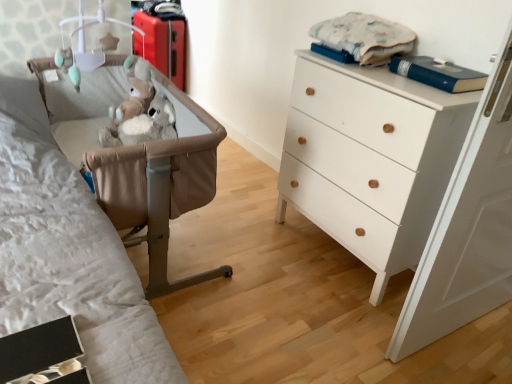
Describe the element at coordinates (160, 189) in the screenshot. I see `tan leather crib at left` at that location.

The width and height of the screenshot is (512, 384). Find the location of `tan leather crib at left`. tan leather crib at left is located at coordinates (160, 189).

The width and height of the screenshot is (512, 384). What do you see at coordinates (85, 44) in the screenshot?
I see `white plastic mobile at upper left` at bounding box center [85, 44].

Find the location of a particular element. This screenshot has width=512, height=384. matte red suitcase at upper left is located at coordinates pos(162,38).

In order to face matte red suitcase at upper left, should I rotate leftwards or rightwards?

Turn left by 12.718 degrees to look at matte red suitcase at upper left.

Find the location of a particular element. This screenshot has height=384, width=512. white wood chest of drawers at right is located at coordinates pos(370,159).

Is white wood chest of drawers at right completely or partially inside white plastic mobile at upper left?

No, white wood chest of drawers at right is not a part of white plastic mobile at upper left.

Is white plastic mobile at upper left touching white wood chest of drawers at right?

No.

In the scene shown: How different are the orientations of white plastic mobile at upper left and white wood chest of drawers at right in degrees?

The angular difference between white plastic mobile at upper left and white wood chest of drawers at right is 91.2 degrees.

Which is more to the right, white plastic mobile at upper left or white wood chest of drawers at right?

Positioned to the right is white wood chest of drawers at right.

Measure the distance between matte red suitcase at upper left and white wood chest of drawers at right.

matte red suitcase at upper left and white wood chest of drawers at right are 2.00 meters apart.

Does matte red suitcase at upper left have a greater width compared to white wood chest of drawers at right?

No, matte red suitcase at upper left is not wider than white wood chest of drawers at right.

Relative to white wood chest of drawers at right, is matte red suitcase at upper left in front or behind?

Visually, matte red suitcase at upper left is located behind white wood chest of drawers at right.

Which is closer, (153,57) or (341,204)?

Clearly, point (153,57) is more distant from the camera than point (341,204).

Considering the relative sizes of matte red suitcase at upper left and white plastic mobile at upper left in the image provided, is matte red suitcase at upper left wider than white plastic mobile at upper left?

In fact, matte red suitcase at upper left might be narrower than white plastic mobile at upper left.

How far apart are matte red suitcase at upper left and white plastic mobile at upper left?

matte red suitcase at upper left is 3.97 feet away from white plastic mobile at upper left.

Is matte red suitcase at upper left far from white plastic mobile at upper left?

Yes, matte red suitcase at upper left and white plastic mobile at upper left are located far from each other.

Does blue hardcover book at upper right have a smaller size compared to tan leather crib at left?

Yes.

Between blue hardcover book at upper right and tan leather crib at left, which one appears on the right side from the viewer's perspective?

blue hardcover book at upper right.

Which point is more distant from viewer, (423, 63) or (174, 201)?

The point (423, 63) is behind.

What's the angular difference between blue hardcover book at upper right and tan leather crib at left's facing directions?

The angular difference between blue hardcover book at upper right and tan leather crib at left is 89.1 degrees.

Can you tell me how much white plastic mobile at upper left and tan leather crib at left differ in facing direction?

The facing directions of white plastic mobile at upper left and tan leather crib at left are 2.07 degrees apart.

From a real-world perspective, which object rests below the other?

tan leather crib at left is physically lower.

Is white plastic mobile at upper left inside or outside of tan leather crib at left?

white plastic mobile at upper left is not inside tan leather crib at left, it's outside.

From the image's perspective, is white plastic mobile at upper left located above or below tan leather crib at left?

white plastic mobile at upper left is above tan leather crib at left.

How different are the orientations of white wood chest of drawers at right and blue hardcover book at upper right in degrees?

0.001 degrees.

Could you tell me if white wood chest of drawers at right is turned towards blue hardcover book at upper right?

No, white wood chest of drawers at right is not oriented towards blue hardcover book at upper right.

In terms of height, does white wood chest of drawers at right look taller or shorter compared to blue hardcover book at upper right?

Clearly, white wood chest of drawers at right is taller compared to blue hardcover book at upper right.

Which is behind, white wood chest of drawers at right or blue hardcover book at upper right?

blue hardcover book at upper right is more distant.

Can you confirm if white plastic mobile at upper left is wider than blue hardcover book at upper right?

Yes, white plastic mobile at upper left is wider than blue hardcover book at upper right.

Would you consider white plastic mobile at upper left to be distant from blue hardcover book at upper right?

Yes, white plastic mobile at upper left is far from blue hardcover book at upper right.

Image resolution: width=512 pixels, height=384 pixels. Find the location of `the chest of drawers that appears below the white plastic mobile at upper left (from the image's perspective)`. the chest of drawers that appears below the white plastic mobile at upper left (from the image's perspective) is located at coordinates (370, 159).

Locate an element on the screen. The height and width of the screenshot is (384, 512). luggage below the white wood chest of drawers at right (from a real-world perspective) is located at coordinates (162, 38).

Based on their spatial positions, is white wood chest of drawers at right or white plastic mobile at upper left further from tan leather crib at left?

Based on the image, white wood chest of drawers at right appears to be further to tan leather crib at left.

When comparing their distances from white plastic mobile at upper left, does blue hardcover book at upper right or white wood chest of drawers at right seem closer?

white wood chest of drawers at right lies closer to white plastic mobile at upper left than the other object.

Based on their spatial positions, is blue hardcover book at upper right or white plastic mobile at upper left closer to tan leather crib at left?

white plastic mobile at upper left lies closer to tan leather crib at left than the other object.

Looking at the image, which one is located further to tan leather crib at left, blue hardcover book at upper right or white wood chest of drawers at right?

blue hardcover book at upper right.

When comparing their distances from matte red suitcase at upper left, does tan leather crib at left or blue hardcover book at upper right seem further?

blue hardcover book at upper right lies further to matte red suitcase at upper left than the other object.

When comparing their distances from white plastic mobile at upper left, does white wood chest of drawers at right or tan leather crib at left seem closer?

Among the two, tan leather crib at left is located nearer to white plastic mobile at upper left.

Looking at the image, which one is located closer to tan leather crib at left, matte red suitcase at upper left or blue hardcover book at upper right?

Among the two, blue hardcover book at upper right is located nearer to tan leather crib at left.

Looking at the image, which one is located further to blue hardcover book at upper right, matte red suitcase at upper left or white wood chest of drawers at right?

Based on the image, matte red suitcase at upper left appears to be further to blue hardcover book at upper right.

Identify the location of furniture between white plastic mobile at upper left and blue hardcover book at upper right in the horizontal direction. (160, 189).

Find the location of a particular element. The image size is (512, 384). lamp between white wood chest of drawers at right and matte red suitcase at upper left along the z-axis is located at coordinates (85, 44).

Find the location of a particular element. lamp positioned between tan leather crib at left and matte red suitcase at upper left from near to far is located at coordinates [85, 44].

You are a GUI agent. You are given a task and a screenshot of the screen. Output one action in this format:
    pyautogui.click(x=<x>, y=<y>)
    Task: Click on the book between white plastic mobile at upper left and matte red suitcase at upper left from front to back
    Image resolution: width=512 pixels, height=384 pixels.
    Given the screenshot: What is the action you would take?
    pyautogui.click(x=437, y=73)